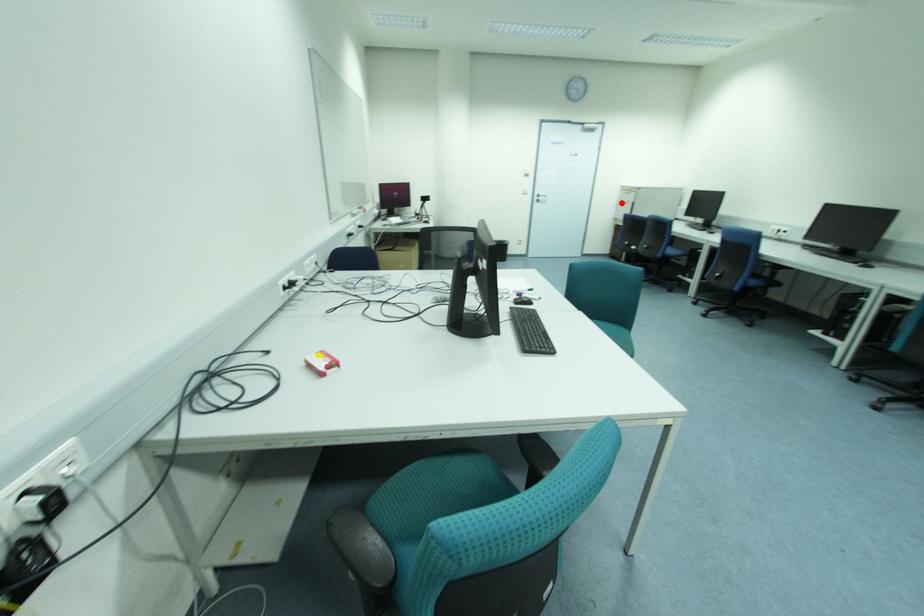
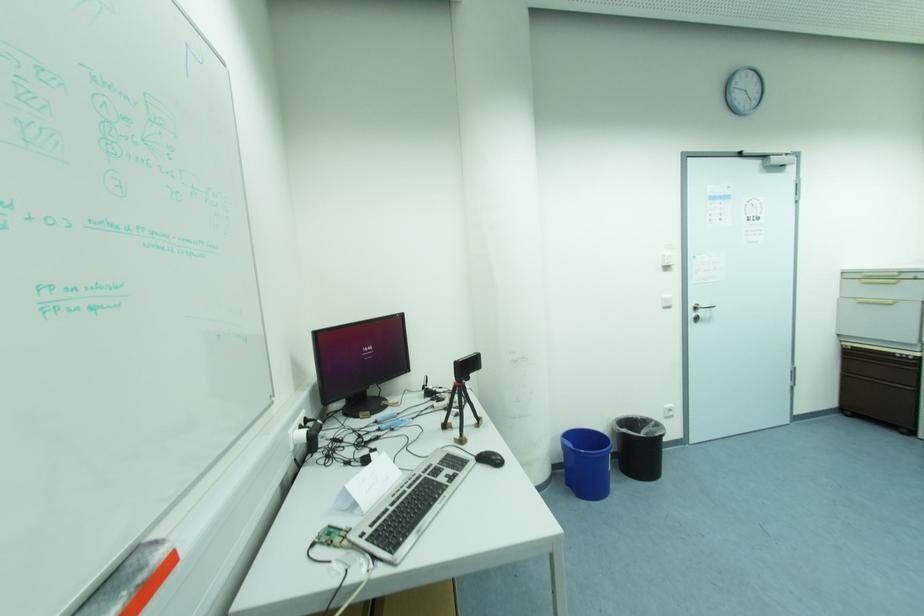
The point at the highlighted location is marked in the first image. Where is the corresponding point in the second image?

(862, 304)